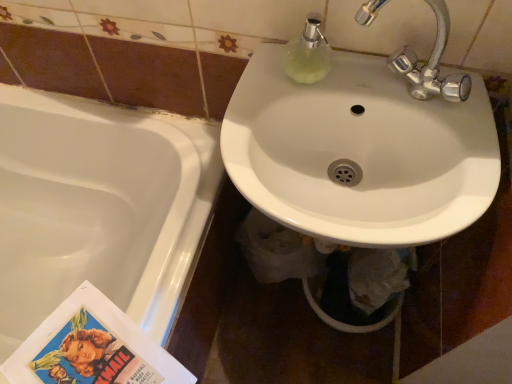
Identify the location of white glossy sink at center. (364, 146).

Would you say white glossy sink at center is part of translucent glass soap dispenser at upper center's contents?

No.

Does translucent glass soap dispenser at upper center have a lesser width compared to white glossy sink at center?

Yes, translucent glass soap dispenser at upper center is thinner than white glossy sink at center.

What are the coordinates of `sink directly beneath the translucent glass soap dispenser at upper center (from a real-world perspective)` in the screenshot? It's located at (364, 146).

Considering the relative sizes of white glossy bathtub at lower left and white glossy sink at center in the image provided, is white glossy bathtub at lower left wider than white glossy sink at center?

Indeed, white glossy bathtub at lower left has a greater width compared to white glossy sink at center.

There is a white glossy bathtub at lower left. Identify the location of sink above it (from a real-world perspective). (364, 146).

Is white glossy bathtub at lower left shorter than white glossy sink at center?

In fact, white glossy bathtub at lower left may be taller than white glossy sink at center.

Is white glossy bathtub at lower left to the left of white glossy sink at center from the viewer's perspective?

Correct, you'll find white glossy bathtub at lower left to the left of white glossy sink at center.

Between white glossy sink at center and white glossy bathtub at lower left, which one has smaller size?

white glossy sink at center.

Between white glossy sink at center and white glossy bathtub at lower left, which one is positioned in front?

white glossy sink at center.

Where is `sink in front of the white glossy bathtub at lower left`? This screenshot has height=384, width=512. sink in front of the white glossy bathtub at lower left is located at coordinates (364, 146).

Between point (329, 67) and point (108, 205), which one is positioned behind?

The point (108, 205) is farther.

In the scene shown: Can you tell me how much translucent glass soap dispenser at upper center and white glossy bathtub at lower left differ in facing direction?

2 degrees separate the facing orientations of translucent glass soap dispenser at upper center and white glossy bathtub at lower left.

Are translucent glass soap dispenser at upper center and white glossy bathtub at lower left located far from each other?

No.

Is translucent glass soap dispenser at upper center oriented away from white glossy bathtub at lower left?

No.

Is white glossy bathtub at lower left inside the boundaries of translucent glass soap dispenser at upper center, or outside?

The correct answer is: outside.

How different are the orientations of white glossy bathtub at lower left and translucent glass soap dispenser at upper center in degrees?

There is a 2-degree angle between the facing directions of white glossy bathtub at lower left and translucent glass soap dispenser at upper center.

You are a GUI agent. You are given a task and a screenshot of the screen. Output one action in this format:
    pyautogui.click(x=<x>, y=<y>)
    Task: Click on the soap dispenser located above the white glossy bathtub at lower left (from the image's perspective)
    
    Given the screenshot: What is the action you would take?
    pyautogui.click(x=308, y=54)

Is white glossy bathtub at lower left behind translucent glass soap dispenser at upper center?

Yes, white glossy bathtub at lower left is further from the viewer.

Is white glossy sink at center thinner than translucent glass soap dispenser at upper center?

In fact, white glossy sink at center might be wider than translucent glass soap dispenser at upper center.

How different are the orientations of white glossy sink at center and translucent glass soap dispenser at upper center in degrees?

white glossy sink at center and translucent glass soap dispenser at upper center are facing 0.863 degrees away from each other.

Could you tell me if white glossy sink at center is turned towards translucent glass soap dispenser at upper center?

No.

Considering the relative sizes of white glossy sink at center and translucent glass soap dispenser at upper center in the image provided, is white glossy sink at center smaller than translucent glass soap dispenser at upper center?

No, white glossy sink at center is not smaller than translucent glass soap dispenser at upper center.

In order to click on soap dispenser on the left of white glossy sink at center in this screenshot , I will do [308, 54].

In the image, there is a white glossy sink at center. Where is `bathtub below it (from the image's perspective)`? The height and width of the screenshot is (384, 512). bathtub below it (from the image's perspective) is located at coordinates (98, 207).

Based on their spatial positions, is translucent glass soap dispenser at upper center or white glossy sink at center closer to white glossy bathtub at lower left?

white glossy sink at center is positioned closer to the anchor white glossy bathtub at lower left.

Based on their spatial positions, is white glossy sink at center or white glossy bathtub at lower left closer to translucent glass soap dispenser at upper center?

white glossy sink at center is closer to translucent glass soap dispenser at upper center.

From the picture: Based on their spatial positions, is white glossy sink at center or translucent glass soap dispenser at upper center further from white glossy bathtub at lower left?

translucent glass soap dispenser at upper center is further to white glossy bathtub at lower left.

Consider the image. Considering their positions, is translucent glass soap dispenser at upper center positioned closer to white glossy sink at center than white glossy bathtub at lower left?

Among the two, translucent glass soap dispenser at upper center is located nearer to white glossy sink at center.

Which object lies further to the anchor point translucent glass soap dispenser at upper center, white glossy bathtub at lower left or white glossy sink at center?

The object further to translucent glass soap dispenser at upper center is white glossy bathtub at lower left.

Looking at the image, which one is located further to white glossy sink at center, white glossy bathtub at lower left or translucent glass soap dispenser at upper center?

Based on the image, white glossy bathtub at lower left appears to be further to white glossy sink at center.

This screenshot has height=384, width=512. Find the location of `soap dispenser located between white glossy bathtub at lower left and white glossy sink at center in the left-right direction`. soap dispenser located between white glossy bathtub at lower left and white glossy sink at center in the left-right direction is located at coordinates (308, 54).